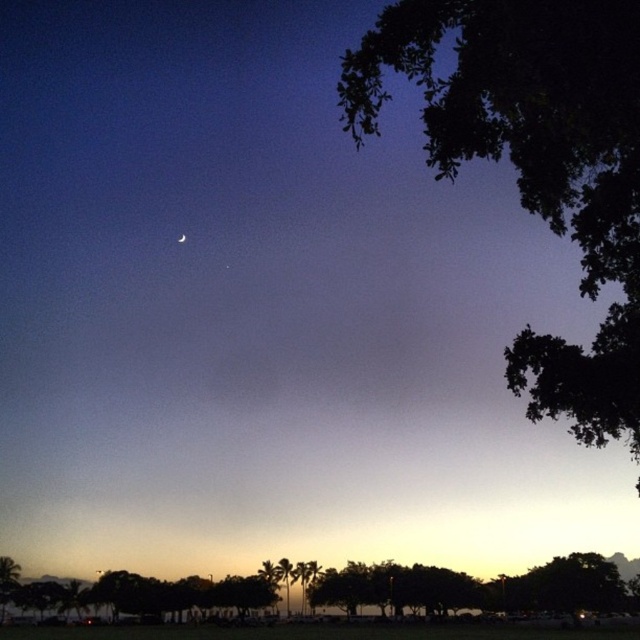
Question: Considering the real-world distances, which object is closest to the dark green leafy tree at upper right?

Choices:
 (A) green leafy tree at lower left
 (B) silver metallic crescent moon at upper center
 (C) green leafy tree at lower center

Answer: (C)

Question: Based on their relative distances, which object is nearer to the green leafy tree at lower center?

Choices:
 (A) green leafy tree at lower left
 (B) dark green leafy tree at upper right
 (C) silver metallic crescent moon at upper center

Answer: (A)

Question: Can you confirm if green leafy tree at lower center is positioned below silver metallic crescent moon at upper center?

Choices:
 (A) no
 (B) yes

Answer: (B)

Question: In this image, where is green leafy tree at lower center located relative to green leafy tree at lower left?

Choices:
 (A) below
 (B) above

Answer: (A)

Question: From the image, what is the correct spatial relationship of green leafy tree at lower left in relation to silver metallic crescent moon at upper center?

Choices:
 (A) right
 (B) left

Answer: (B)

Question: Which object is closer to the camera taking this photo?

Choices:
 (A) green leafy tree at lower center
 (B) silver metallic crescent moon at upper center
 (C) green leafy tree at lower left
 (D) dark green leafy tree at upper right

Answer: (D)